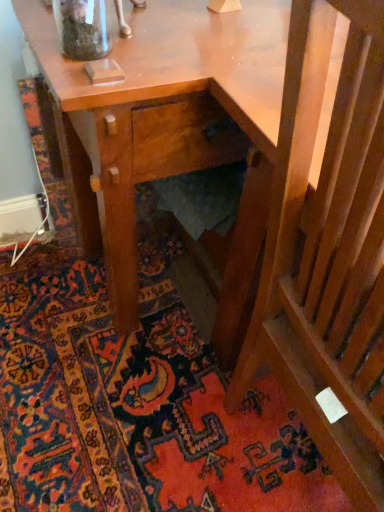
Question: Would you say carpeted stairs at lower right is to the left or to the right of clear glass jar at upper left in the picture?

Choices:
 (A) left
 (B) right

Answer: (A)

Question: Would you say carpeted stairs at lower right is inside or outside clear glass jar at upper left?

Choices:
 (A) inside
 (B) outside

Answer: (B)

Question: Based on their relative distances, which object is nearer to the clear glass jar at upper left?

Choices:
 (A) carpeted stairs at lower right
 (B) wooden slats at lower right

Answer: (B)

Question: Which object is positioned closest to the carpeted stairs at lower right?

Choices:
 (A) clear glass jar at upper left
 (B) wooden slats at lower right

Answer: (B)